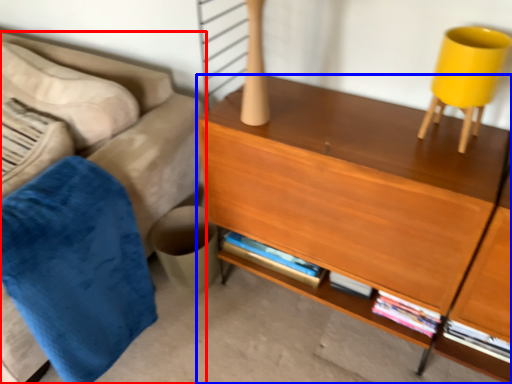
Question: Among these objects, which one is nearest to the camera, studio couch (highlighted by a red box) or desk (highlighted by a blue box)?

Choices:
 (A) studio couch
 (B) desk

Answer: (B)